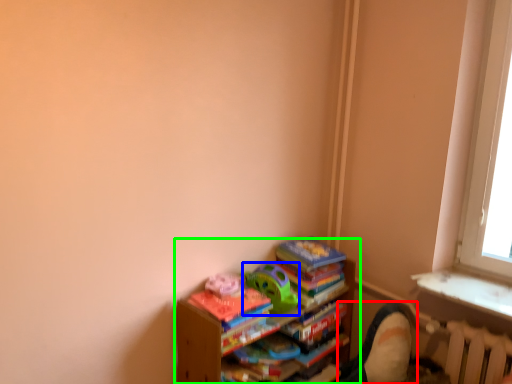
Question: Considering the real-world distances, which object is farthest from swivel chair (highlighted by a red box)? toy (highlighted by a blue box) or shelf (highlighted by a green box)?

Choices:
 (A) toy
 (B) shelf

Answer: (A)